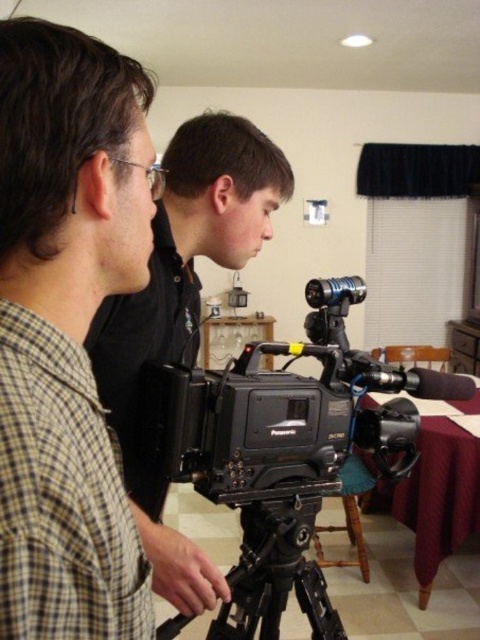
You are a camera operator adjusting the focus on the Panasonic video camera. You need to focus on two points in the scene. The first point is at point [468,387] and the second point is at point [120,339]. Which point is closer to the camera lens?

Point [120,339] is closer to the camera lens because the description states that point [468,387] is further away from the camera than point [120,339].

You are standing in the room and want to place a new monitor exactly where the black matte camera at center is currently located. What are the coordinates you should use for placement?

The coordinates for the black matte camera at center are at point (x=188, y=252), so you should place the new monitor at those coordinates.

You are a camera technician who needs to adjust the distance between the black plastic video camera at center and the black matte camera at center to 25 centimeters. Given their current distance is 20.96 centimeters, how much more space do you need to add between them?

The current distance between the black plastic video camera at center and the black matte camera at center is 20.96 centimeters. To reach 25 centimeters, you need to add an additional 4.04 centimeters between them.